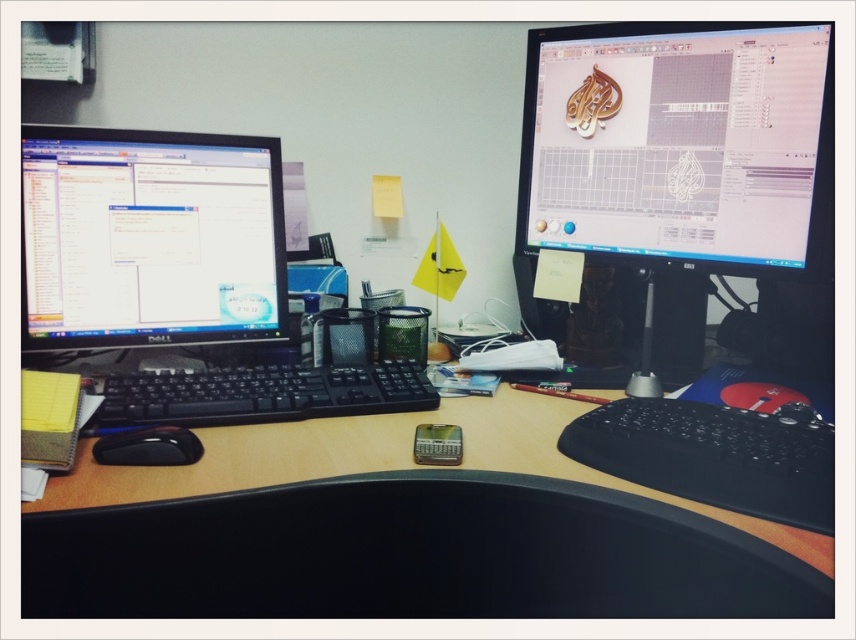
Question: Observing the image, what is the correct spatial positioning of black rubberized keyboard at lower right in reference to black plastic keyboard at center?

Choices:
 (A) right
 (B) left

Answer: (A)

Question: Which object is positioned closest to the wooden at center?

Choices:
 (A) matte black monitor at upper right
 (B) black rubber mouse at lower left
 (C) black rubberized keyboard at lower right

Answer: (C)

Question: Does wooden at center appear on the left side of black plastic keyboard at center?

Choices:
 (A) yes
 (B) no

Answer: (B)

Question: Which point is farther to the camera?

Choices:
 (A) matte black monitor at upper right
 (B) black plastic keyboard at center
 (C) wooden at center
 (D) black glossy monitor at left

Answer: (D)

Question: Does matte black monitor at upper right appear on the right side of black rubber mouse at lower left?

Choices:
 (A) yes
 (B) no

Answer: (A)

Question: Among these objects, which one is nearest to the camera?

Choices:
 (A) matte black monitor at upper right
 (B) wooden at center

Answer: (B)